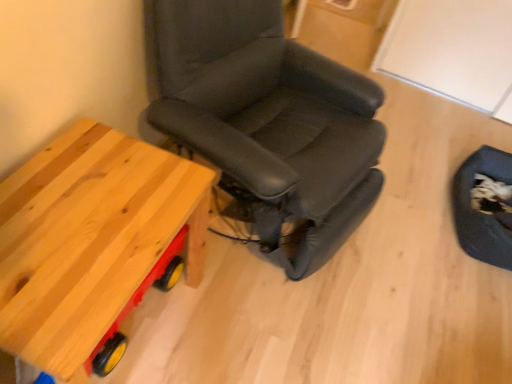
I want to click on free location to the right of natural wood table at left, so click(238, 320).